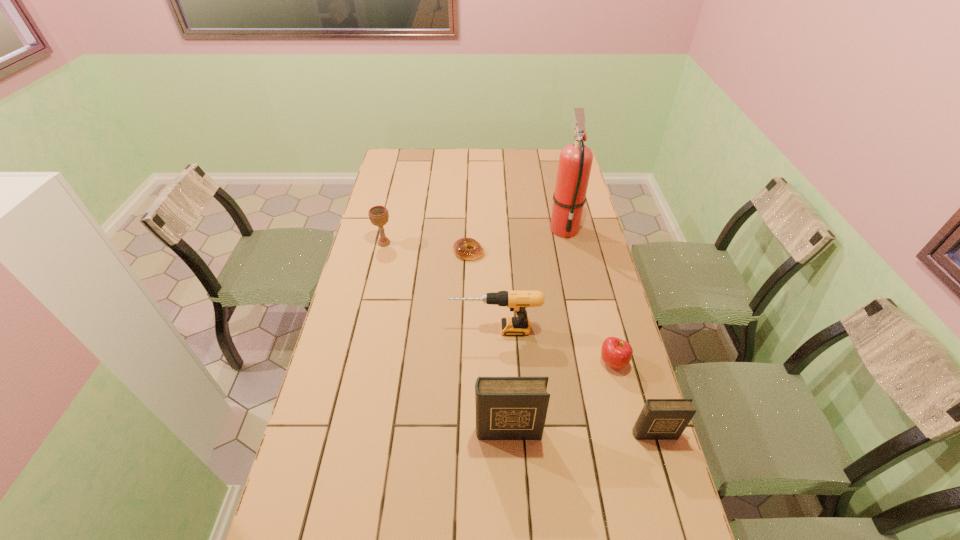
Where is `vacant place for an extra diary on the left`? The width and height of the screenshot is (960, 540). vacant place for an extra diary on the left is located at coordinates (363, 429).